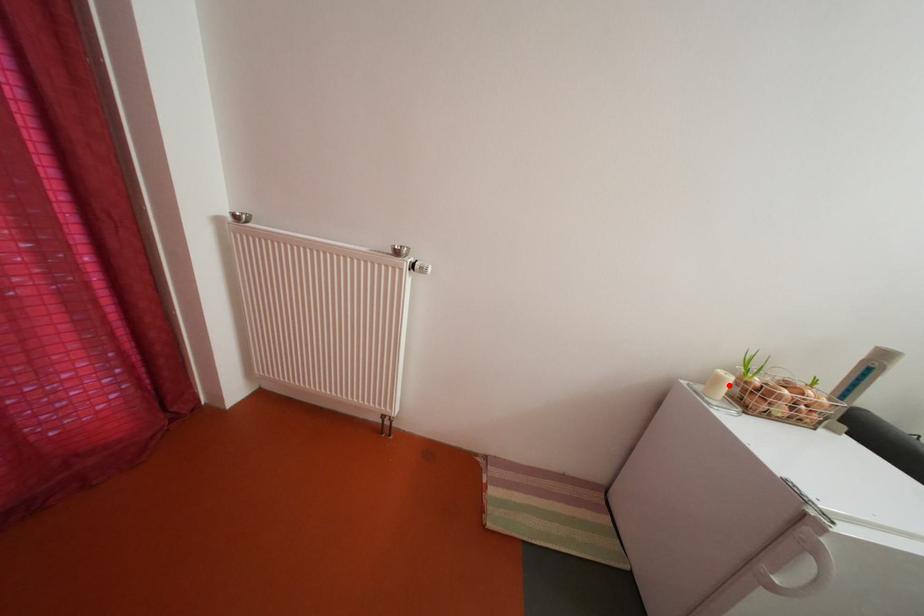
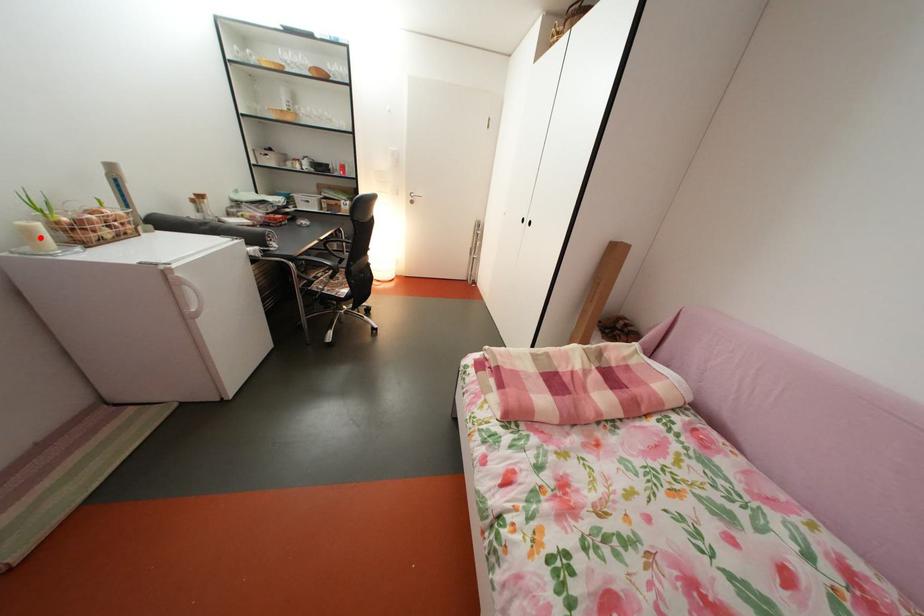
I am providing you with two images of the same scene from different viewpoints. A red point is marked on the first image and another point is marked on the second image. Is the red point in image1 aligned with the point shown in image2?

Yes